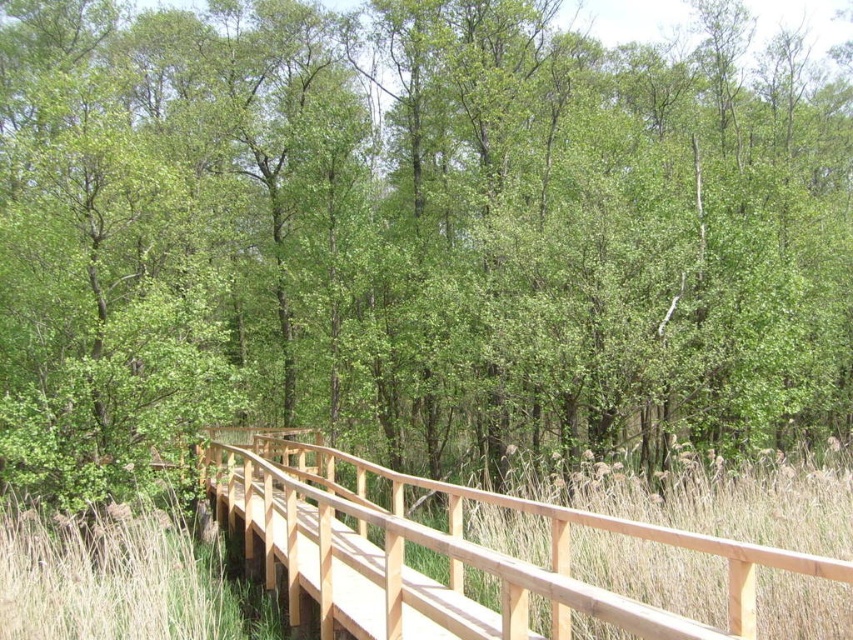
You are a hiker who wants to cross the natural wood bridge at center without stepping on the golden reeds at center. Can you do that?

The natural wood bridge at center is larger in size than golden reeds at center, so yes, you can cross the natural wood bridge at center without stepping on the golden reeds at center.

Looking at this image, you are standing on the wooden boardwalk in the forest and notice a point marked at coordinates (447, 554). What structure is located at that point?

The point at (447, 554) marks the location of the natural wood bridge at center.